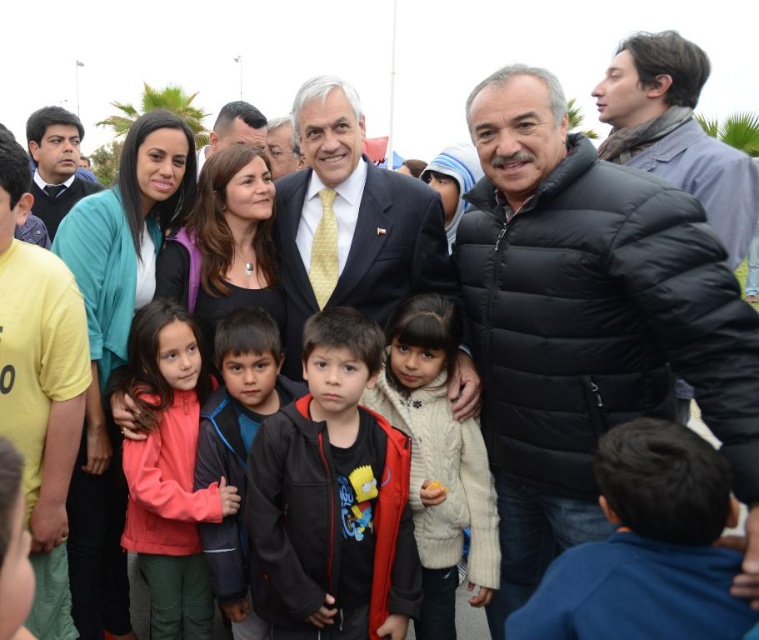
Question: Which of these objects is positioned farthest from the matte black shirt at left?

Choices:
 (A) matte black suit at left
 (B) black matte jacket at center

Answer: (A)

Question: Can you confirm if black puffy jacket at center is wider than matte black suit at center?

Choices:
 (A) no
 (B) yes

Answer: (B)

Question: Is black puffy jacket at center bigger than matte black suit at center?

Choices:
 (A) no
 (B) yes

Answer: (B)

Question: Considering the relative positions of black puffy jacket at center and matte pink jacket at center in the image provided, where is black puffy jacket at center located with respect to matte pink jacket at center?

Choices:
 (A) left
 (B) right

Answer: (B)

Question: Which point is closer to the camera?

Choices:
 (A) (575, 346)
 (B) (93, 188)

Answer: (A)

Question: Estimate the real-world distances between objects in this image. Which object is farther from the blue down jacket at upper right?

Choices:
 (A) matte black suit at center
 (B) matte black shirt at left
 (C) black matte jacket at center

Answer: (B)